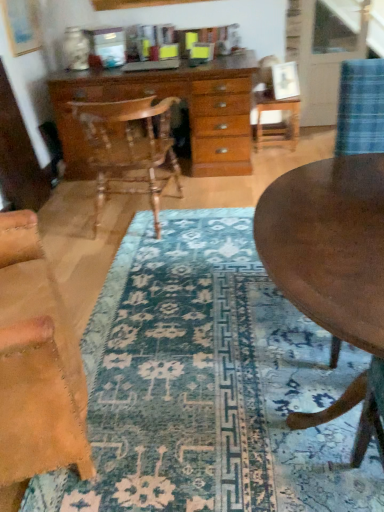
What do you see at coordinates (277, 123) in the screenshot? I see `wooden side table at center` at bounding box center [277, 123].

Where is `wooden chest of drawers at center`? This screenshot has height=512, width=384. wooden chest of drawers at center is located at coordinates (163, 98).

Where is `leather at left, the second chair positioned from the back`? Image resolution: width=384 pixels, height=512 pixels. leather at left, the second chair positioned from the back is located at coordinates (37, 362).

Which chair is the 2nd one when counting from the front of the wooden side table at center? Please provide its 2D coordinates.

[(37, 362)]

From a real-world perspective, which is physically below, wooden side table at center or leather at left, which ranks as the first chair in bottom-to-top order?

From a 3D spatial view, wooden side table at center is below.

From the image's perspective, which one is positioned higher, wooden side table at center or leather at left, which ranks as the first chair in bottom-to-top order?

wooden side table at center is shown above in the image.

Is wooden side table at center turned away from wooden chest of drawers at center?

No, wooden chest of drawers at center is not at the back of wooden side table at center.

Can you tell me how much wooden side table at center and wooden chest of drawers at center differ in facing direction?

The facing directions of wooden side table at center and wooden chest of drawers at center are 0.0103 degrees apart.

Which of these two, wooden side table at center or wooden chest of drawers at center, is smaller?

With smaller size is wooden side table at center.

From the picture: Is blue patterned rug at center inside or outside of wooden chest of drawers at center?

blue patterned rug at center is not inside wooden chest of drawers at center, it's outside.

From a real-world perspective, who is located higher, blue patterned rug at center or wooden chest of drawers at center?

wooden chest of drawers at center, from a real-world perspective.

How distant is blue patterned rug at center from wooden chest of drawers at center?

The distance of blue patterned rug at center from wooden chest of drawers at center is 4.11 feet.

Is blue patterned rug at center far away from wooden chest of drawers at center?

Absolutely, blue patterned rug at center is distant from wooden chest of drawers at center.

Is leather at left, which ranks as the first chair in bottom-to-top order, next to wooden polished chair at center, which is the first chair in top-to-bottom order?

There is a gap between leather at left, which ranks as the first chair in bottom-to-top order, and wooden polished chair at center, which is the first chair in top-to-bottom order.

From a real-world perspective, relative to wooden polished chair at center, placed as the 2th chair when sorted from bottom to top, is leather at left, which ranks as the first chair in bottom-to-top order, vertically above or below?

From a real-world perspective, leather at left, which ranks as the first chair in bottom-to-top order, is physically above wooden polished chair at center, placed as the 2th chair when sorted from bottom to top.

Can you confirm if leather at left, the 2th chair when ordered from top to bottom, is bigger than wooden polished chair at center, which is the first chair in top-to-bottom order?

Incorrect, leather at left, the 2th chair when ordered from top to bottom, is not larger than wooden polished chair at center, which is the first chair in top-to-bottom order.

Can you confirm if leather at left, the first chair positioned from the front, is taller than wooden polished chair at center, the first chair viewed from the back?

Correct, leather at left, the first chair positioned from the front, is much taller as wooden polished chair at center, the first chair viewed from the back.

This screenshot has width=384, height=512. Identify the location of chair that is the 2nd object above the blue patterned rug at center (from a real-world perspective). (37, 362).

Would you say blue patterned rug at center is inside or outside leather at left, which ranks as the first chair in bottom-to-top order?

blue patterned rug at center lies outside leather at left, which ranks as the first chair in bottom-to-top order.

Looking at their sizes, would you say blue patterned rug at center is wider or thinner than leather at left, which ranks as the first chair in bottom-to-top order?

blue patterned rug at center is wider than leather at left, which ranks as the first chair in bottom-to-top order.

Are blue patterned rug at center and leather at left, which ranks as the first chair in bottom-to-top order, making contact?

No, blue patterned rug at center is not with leather at left, which ranks as the first chair in bottom-to-top order.

From a real-world perspective, which object stands above the other?

leather at left, the first chair positioned from the front.

Does leather at left, the first chair positioned from the front, appear on the right side of wooden side table at center?

In fact, leather at left, the first chair positioned from the front, is to the left of wooden side table at center.

From the picture: Is leather at left, the 2th chair when ordered from top to bottom, looking in the opposite direction of wooden side table at center?

No, leather at left, the 2th chair when ordered from top to bottom, is not facing the opposite direction of wooden side table at center.

Consider the image. Who is more distant, leather at left, the first chair positioned from the front, or wooden side table at center?

Positioned behind is wooden side table at center.

From a real-world perspective, is blue patterned rug at center physically located above or below wooden round table at center?

From a real-world perspective, blue patterned rug at center is physically below wooden round table at center.

Is the depth of blue patterned rug at center greater than that of wooden round table at center?

Yes, it is behind wooden round table at center.

From the image's perspective, starting from the wooden side table at center, which chair is the 2nd one below? Please provide its 2D coordinates.

[(37, 362)]

Locate an element on the screen. side table behind the wooden chest of drawers at center is located at coordinates (277, 123).

When comparing their distances from wooden round table at center, does wooden polished chair at center, placed as the 2th chair when sorted from bottom to top, or wooden side table at center seem closer?

wooden polished chair at center, placed as the 2th chair when sorted from bottom to top, is positioned closer to the anchor wooden round table at center.

Based on their spatial positions, is leather at left, the 2th chair when ordered from top to bottom, or wooden polished chair at center, placed as the 2th chair when sorted from bottom to top, closer to wooden side table at center?

wooden polished chair at center, placed as the 2th chair when sorted from bottom to top, is positioned closer to the anchor wooden side table at center.

Based on their spatial positions, is leather at left, the first chair positioned from the front, or wooden side table at center further from wooden polished chair at center, placed as the second chair when sorted from front to back?

Among the two, wooden side table at center is located further to wooden polished chair at center, placed as the second chair when sorted from front to back.

Which object lies further to the anchor point wooden round table at center, wooden side table at center or blue patterned rug at center?

Among the two, wooden side table at center is located further to wooden round table at center.

From the image, which object appears to be farther from leather at left, the second chair positioned from the back, wooden polished chair at center, placed as the 2th chair when sorted from bottom to top, or blue patterned rug at center?

wooden polished chair at center, placed as the 2th chair when sorted from bottom to top, lies further to leather at left, the second chair positioned from the back, than the other object.

From the picture: Considering their positions, is wooden polished chair at center, the first chair viewed from the back, positioned further to leather at left, which ranks as the first chair in bottom-to-top order, than wooden chest of drawers at center?

Based on the image, wooden chest of drawers at center appears to be further to leather at left, which ranks as the first chair in bottom-to-top order.

Based on their spatial positions, is wooden round table at center or wooden polished chair at center, placed as the second chair when sorted from front to back, closer to wooden side table at center?

Among the two, wooden polished chair at center, placed as the second chair when sorted from front to back, is located nearer to wooden side table at center.

From the picture: Which object lies further to the anchor point wooden polished chair at center, the first chair viewed from the back, wooden side table at center or blue patterned rug at center?

wooden side table at center lies further to wooden polished chair at center, the first chair viewed from the back, than the other object.

The image size is (384, 512). I want to click on chair between wooden round table at center and wooden polished chair at center, which is the first chair in top-to-bottom order, along the z-axis, so click(x=37, y=362).

Image resolution: width=384 pixels, height=512 pixels. In order to click on mat between leather at left, the second chair positioned from the back, and wooden polished chair at center, placed as the second chair when sorted from front to back, from front to back in this screenshot , I will do `click(207, 385)`.

Image resolution: width=384 pixels, height=512 pixels. Identify the location of chair located between leather at left, the first chair positioned from the front, and wooden chest of drawers at center in the depth direction. (129, 147).

You are a GUI agent. You are given a task and a screenshot of the screen. Output one action in this format:
    pyautogui.click(x=<x>, y=<y>)
    Task: Click on the mat between wooden round table at center and wooden side table at center in the front-back direction
    The height and width of the screenshot is (512, 384).
    Given the screenshot: What is the action you would take?
    pyautogui.click(x=207, y=385)